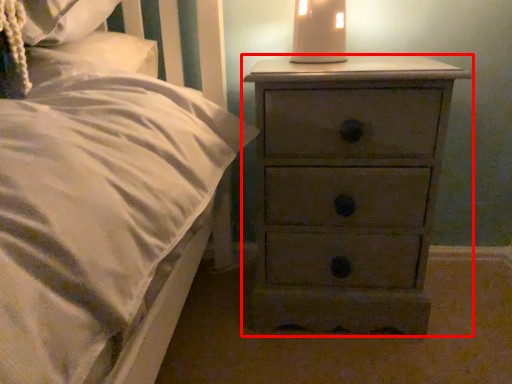
Question: From the image's perspective, where is chest of drawers (annotated by the red box) located in relation to bedside lamp in the image?

Choices:
 (A) above
 (B) below

Answer: (B)